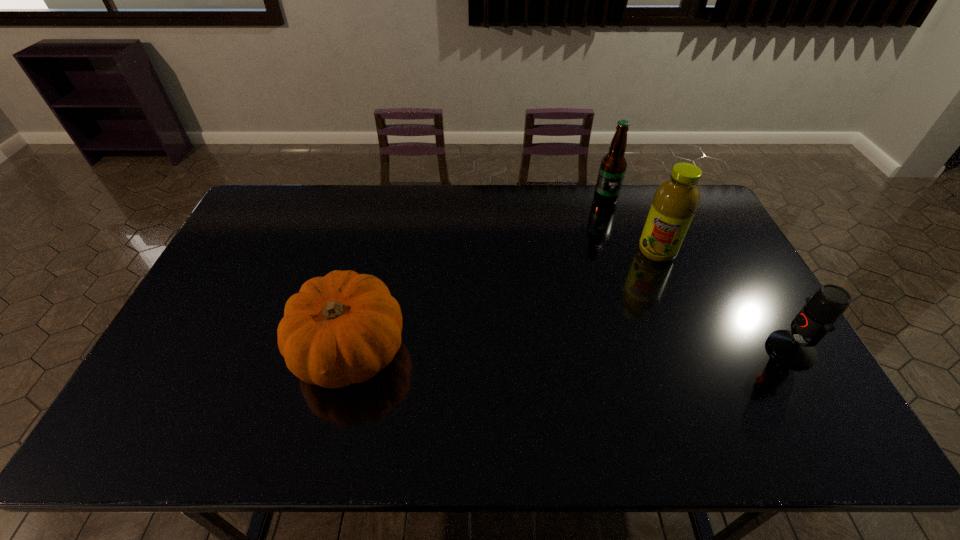
Where is `free spot between the third nearest object and the pumpkin`? free spot between the third nearest object and the pumpkin is located at coordinates (504, 300).

Where is `free space between the leftmost object and the third object from left to right`? free space between the leftmost object and the third object from left to right is located at coordinates (504, 300).

Where is `free space between the beer bottle and the leftmost object`? The image size is (960, 540). free space between the beer bottle and the leftmost object is located at coordinates (478, 275).

What are the coordinates of `free space between the second object from left to right and the third nearest object` in the screenshot? It's located at (631, 225).

The image size is (960, 540). Identify the location of the closest object to the fruit juice. (613, 165).

Locate which object ranks in proximity to the microphone. Please provide its 2D coordinates. Your answer should be formatted as a tuple, i.e. [(x, y)], where the tuple contains the x and y coordinates of a point satisfying the conditions above.

[(676, 200)]

At what (x,y) coordinates should I click in order to perform the action: click on vacant space that satisfies the following two spatial constraints: 1. on the front side of the fruit juice; 2. on the right side of the beer bottle. Please return your answer as a coordinate pair (x, y). The image size is (960, 540). Looking at the image, I should click on (622, 251).

At what (x,y) coordinates should I click in order to perform the action: click on vacant space that satisfies the following two spatial constraints: 1. on the back side of the leftmost object; 2. on the left side of the third object from right to left. Please return your answer as a coordinate pair (x, y). This screenshot has width=960, height=540. Looking at the image, I should click on (387, 200).

Find the location of a particular element. The image size is (960, 540). vacant space that satisfies the following two spatial constraints: 1. on the front side of the beer bottle; 2. on the left side of the third object from left to right is located at coordinates (622, 251).

Image resolution: width=960 pixels, height=540 pixels. I want to click on free space in the image that satisfies the following two spatial constraints: 1. on the front side of the rightmost object; 2. on the side of the beer bottle with the red ring, so click(655, 350).